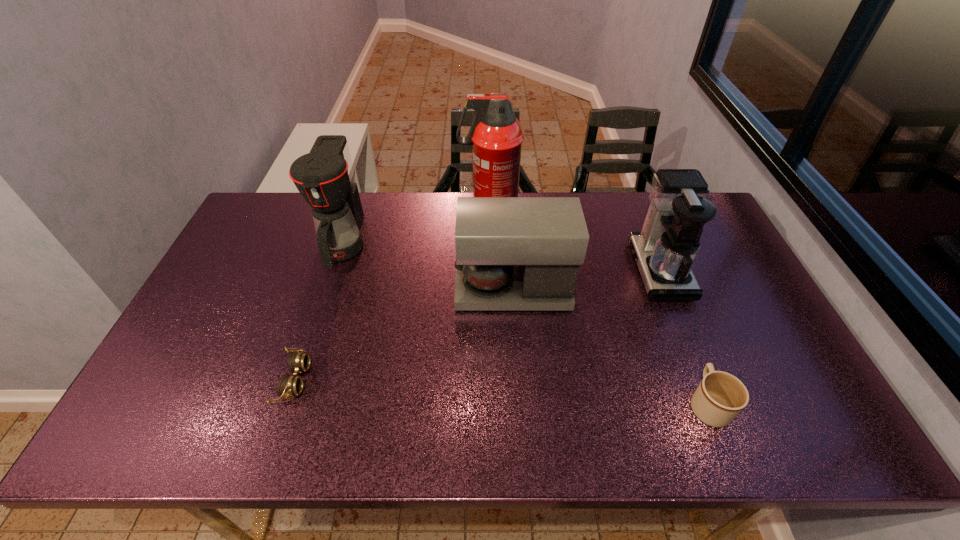
Where is `fire extinguisher located at the far edge`? This screenshot has height=540, width=960. fire extinguisher located at the far edge is located at coordinates (496, 135).

The height and width of the screenshot is (540, 960). In order to click on coffee maker that is positioned at the far edge in this screenshot , I will do `click(325, 178)`.

The height and width of the screenshot is (540, 960). I want to click on object at the near edge, so (720, 397).

Where is `free point at the far edge`? This screenshot has height=540, width=960. free point at the far edge is located at coordinates (472, 193).

Locate an element on the screen. free space at the near edge of the desktop is located at coordinates (208, 415).

Image resolution: width=960 pixels, height=540 pixels. I want to click on vacant area at the left edge, so click(x=141, y=402).

The width and height of the screenshot is (960, 540). In the image, there is a desktop. What are the coordinates of `vacant space at the right edge` in the screenshot? It's located at (708, 303).

The height and width of the screenshot is (540, 960). In order to click on free space that is in between the second shortest object and the tallest object in this screenshot , I will do `click(598, 307)`.

Locate an element on the screen. The image size is (960, 540). vacant space in between the rightmost coffee maker and the second coffee maker from left to right is located at coordinates click(x=587, y=280).

I want to click on vacant area that lies between the rightmost coffee maker and the fifth tallest object, so click(684, 337).